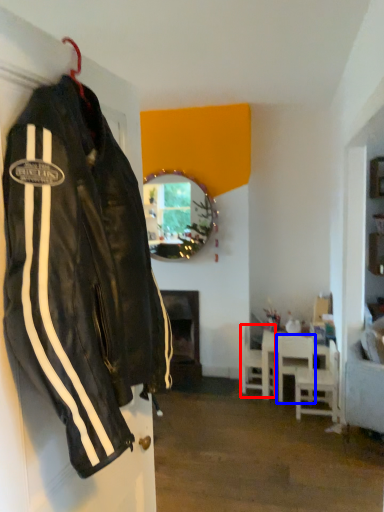
Question: Which of the following is the farthest to the observer, chair (highlighted by a red box) or chair (highlighted by a blue box)?

Choices:
 (A) chair
 (B) chair

Answer: (A)